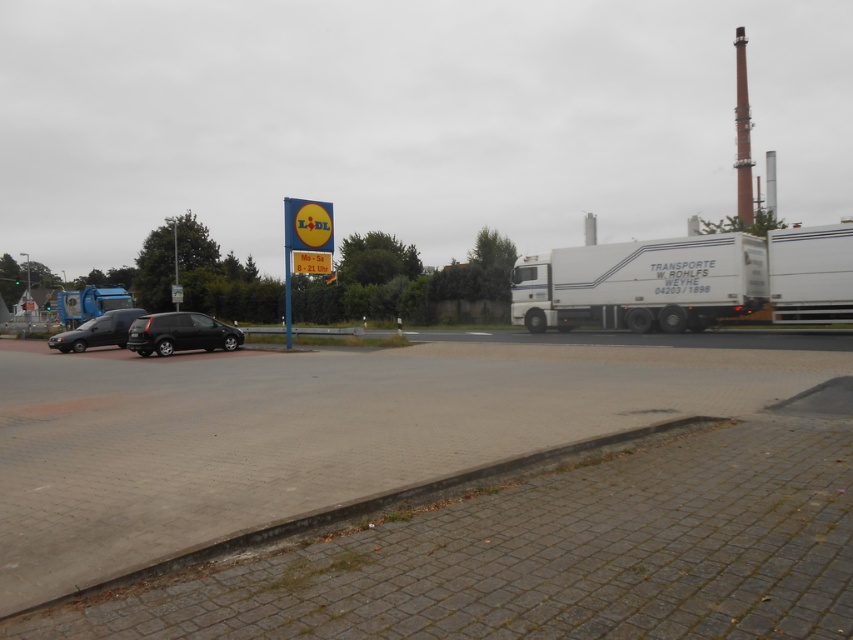
Question: Which point is closer to the camera?

Choices:
 (A) (90, 320)
 (B) (752, 380)

Answer: (B)

Question: Which point appears farthest from the camera in this image?

Choices:
 (A) (103, 316)
 (B) (329, 204)
 (C) (320, 230)

Answer: (A)

Question: Which object is the farthest from the shiny black car at lower left?

Choices:
 (A) blue plastic sign at center
 (B) yellow plastic sign at center

Answer: (B)

Question: Can you confirm if shiny black car at left is smaller than shiny black car at lower left?

Choices:
 (A) no
 (B) yes

Answer: (B)

Question: From the image, what is the correct spatial relationship of shiny black car at left in relation to yellow plastic sign at center?

Choices:
 (A) above
 (B) below

Answer: (B)

Question: Can you confirm if yellow plastic sign at center is bigger than shiny black car at lower left?

Choices:
 (A) yes
 (B) no

Answer: (B)